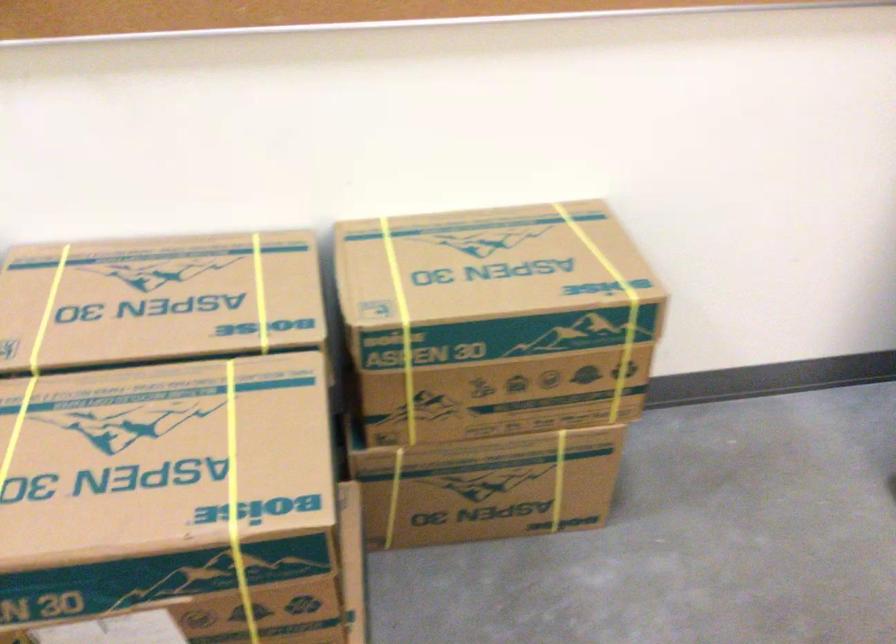
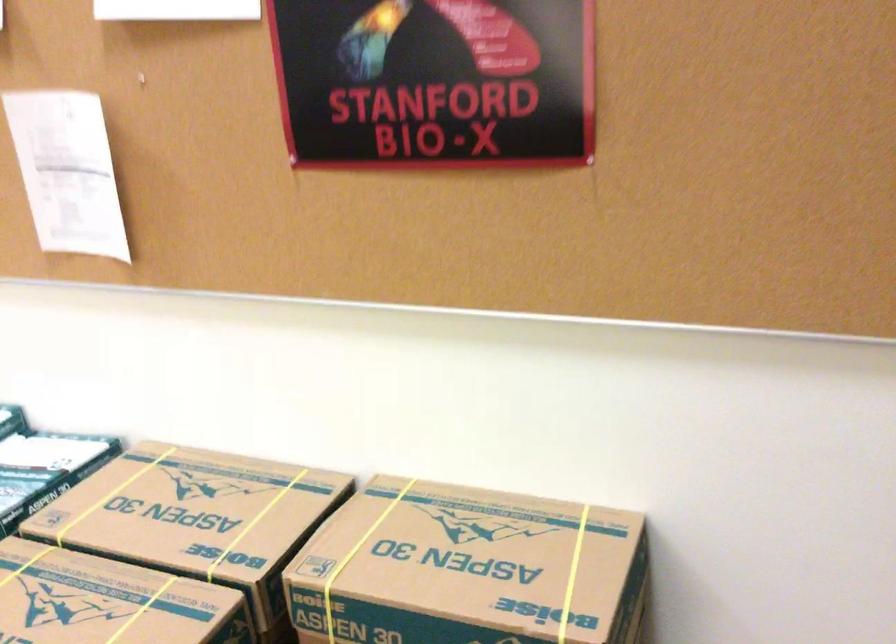
The point at (199, 305) is marked in the first image. Where is the corresponding point in the second image?

(197, 518)